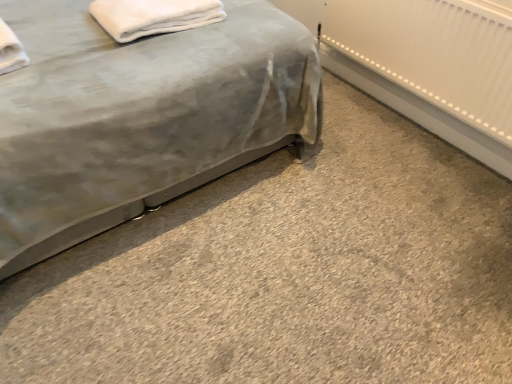
Question: From the image's perspective, is white fluffy towel at upper left beneath velvet gray bed at lower left?

Choices:
 (A) yes
 (B) no

Answer: (A)

Question: Are white fluffy towel at upper left and velvet gray bed at lower left beside each other?

Choices:
 (A) no
 (B) yes

Answer: (A)

Question: Considering the relative sizes of white fluffy towel at upper left and velvet gray bed at lower left in the image provided, is white fluffy towel at upper left taller than velvet gray bed at lower left?

Choices:
 (A) no
 (B) yes

Answer: (A)

Question: Considering the relative positions of white fluffy towel at upper left and velvet gray bed at lower left in the image provided, is white fluffy towel at upper left to the right of velvet gray bed at lower left from the viewer's perspective?

Choices:
 (A) yes
 (B) no

Answer: (A)

Question: Is the position of white fluffy towel at upper left more distant than that of velvet gray bed at lower left?

Choices:
 (A) no
 (B) yes

Answer: (B)

Question: Can you confirm if white fluffy towel at upper left is thinner than velvet gray bed at lower left?

Choices:
 (A) yes
 (B) no

Answer: (A)

Question: Does velvet gray bed at lower left lie in front of white fluffy towel at upper left?

Choices:
 (A) no
 (B) yes

Answer: (B)

Question: From the image's perspective, does velvet gray bed at lower left appear higher than white fluffy towel at upper left?

Choices:
 (A) yes
 (B) no

Answer: (A)

Question: Is velvet gray bed at lower left at the right side of white fluffy towel at upper left?

Choices:
 (A) yes
 (B) no

Answer: (B)

Question: Is velvet gray bed at lower left taller than white fluffy towel at upper left?

Choices:
 (A) no
 (B) yes

Answer: (B)

Question: Would you say velvet gray bed at lower left contains white fluffy towel at upper left?

Choices:
 (A) yes
 (B) no

Answer: (A)

Question: Considering the relative sizes of velvet gray bed at lower left and white fluffy towel at upper left in the image provided, is velvet gray bed at lower left thinner than white fluffy towel at upper left?

Choices:
 (A) yes
 (B) no

Answer: (B)

Question: Considering the positions of point (89, 132) and point (98, 21), is point (89, 132) closer or farther from the camera than point (98, 21)?

Choices:
 (A) closer
 (B) farther

Answer: (A)